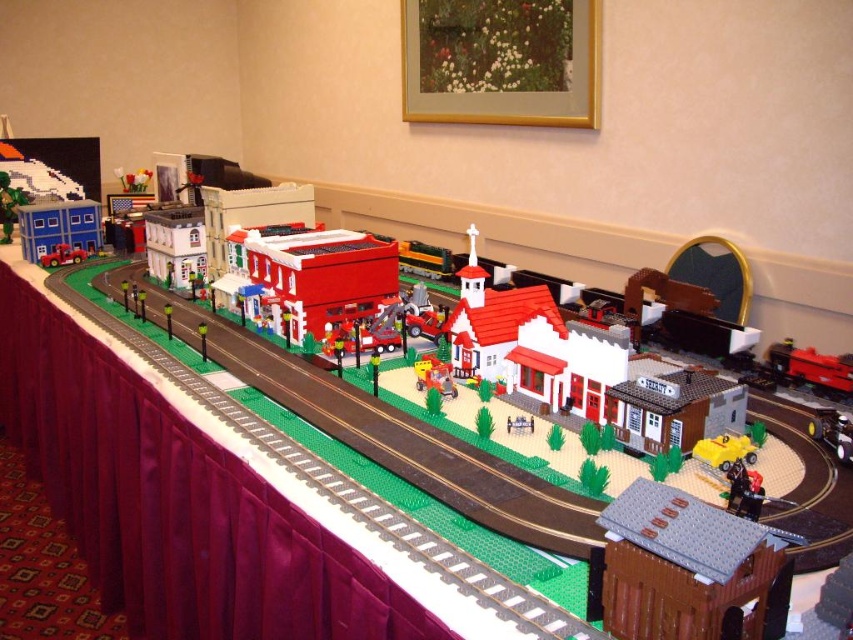
Question: Does brick red building at center appear under metallic red train at lower right?

Choices:
 (A) no
 (B) yes

Answer: (A)

Question: Among these objects, which one is nearest to the camera?

Choices:
 (A) yellow matte truck at center
 (B) matte red truck at center
 (C) matte blue building at left

Answer: (A)

Question: Is brick red building at center bigger than matte red truck at center?

Choices:
 (A) yes
 (B) no

Answer: (A)

Question: Observing the image, what is the correct spatial positioning of yellow matte truck at center in reference to matte black train car at left?

Choices:
 (A) right
 (B) left

Answer: (A)

Question: Which point is farther to the camera?

Choices:
 (A) (753, 461)
 (B) (373, 298)

Answer: (B)

Question: Which object is positioned farthest from the smooth plastic fire truck at center?

Choices:
 (A) matte plastic train car at center
 (B) metallic red train at lower right

Answer: (B)